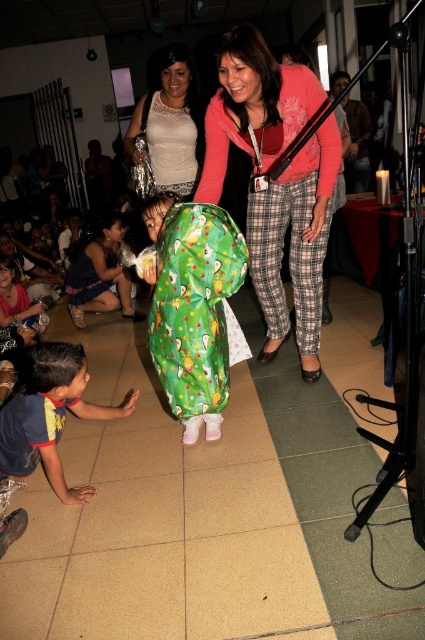
Question: Which point is farther to the camera?

Choices:
 (A) (197, 122)
 (B) (161, 188)

Answer: (B)

Question: Does blue cotton shirt at lower left have a larger size compared to green fabric dress at center?

Choices:
 (A) yes
 (B) no

Answer: (B)

Question: Observing the image, what is the correct spatial positioning of green fabric dress at center in reference to white lace dress at upper center?

Choices:
 (A) above
 (B) below

Answer: (B)

Question: Among these points, which one is nearest to the camera?

Choices:
 (A) (147, 144)
 (B) (79, 349)

Answer: (B)

Question: Which object is the closest to the blue cotton shirt at lower left?

Choices:
 (A) white lace dress at upper center
 (B) pink soft sweater at center

Answer: (B)

Question: Is green fabric dress at center further to camera compared to white lace dress at upper center?

Choices:
 (A) no
 (B) yes

Answer: (B)